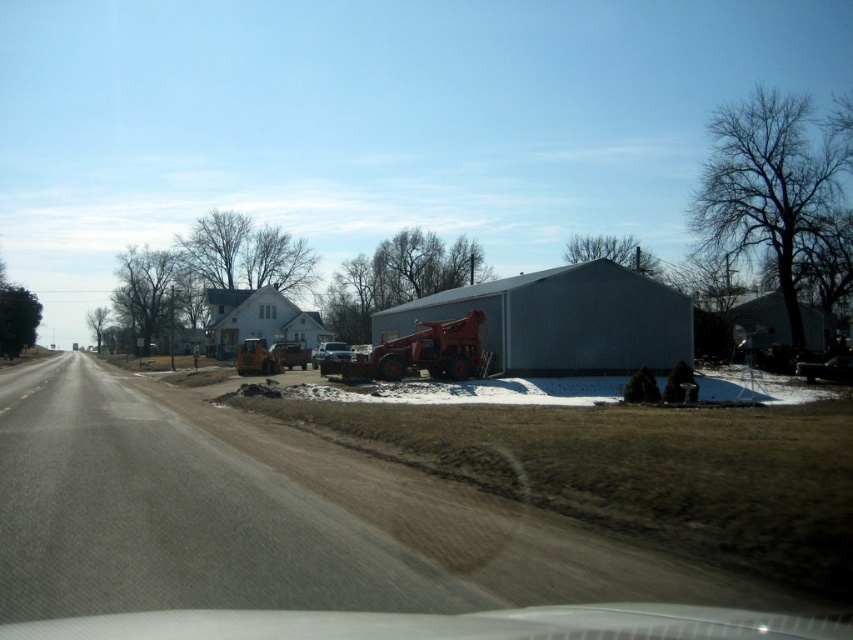
You are driving a car and see the white matte house at center and the metallic yellow tractor at center ahead on the road. Which object appears taller from your perspective?

The white matte house at center appears taller than the metallic yellow tractor at center because it is much taller according to the description.

You are driving along the road in the image and see a point marked at coordinates (257, 321). What object is located at that point?

The point at coordinates (257, 321) marks the white matte house at center.